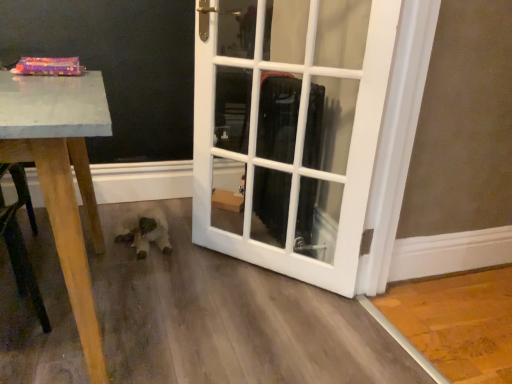
Question: Based on their positions, is white glossy door at center located to the left or right of white plush toy at lower center?

Choices:
 (A) left
 (B) right

Answer: (B)

Question: Which is correct: white glossy door at center is inside white plush toy at lower center, or outside of it?

Choices:
 (A) inside
 (B) outside

Answer: (B)

Question: From the image's perspective, is white glossy door at center located above or below white plush toy at lower center?

Choices:
 (A) above
 (B) below

Answer: (A)

Question: In terms of size, does white plush toy at lower center appear bigger or smaller than white glossy door at center?

Choices:
 (A) small
 (B) big

Answer: (A)

Question: Relative to white glossy door at center, is white plush toy at lower center in front or behind?

Choices:
 (A) behind
 (B) front

Answer: (A)

Question: In terms of width, does white plush toy at lower center look wider or thinner when compared to white glossy door at center?

Choices:
 (A) thin
 (B) wide

Answer: (B)

Question: Considering the positions of point (134, 221) and point (263, 153), is point (134, 221) closer or farther from the camera than point (263, 153)?

Choices:
 (A) farther
 (B) closer

Answer: (A)